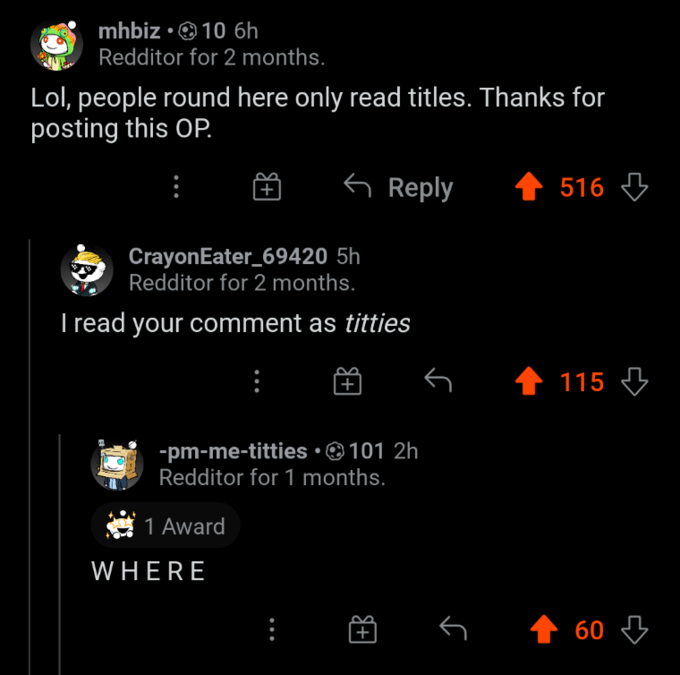
Where is `award`? This screenshot has width=680, height=675. award is located at coordinates (177, 534).